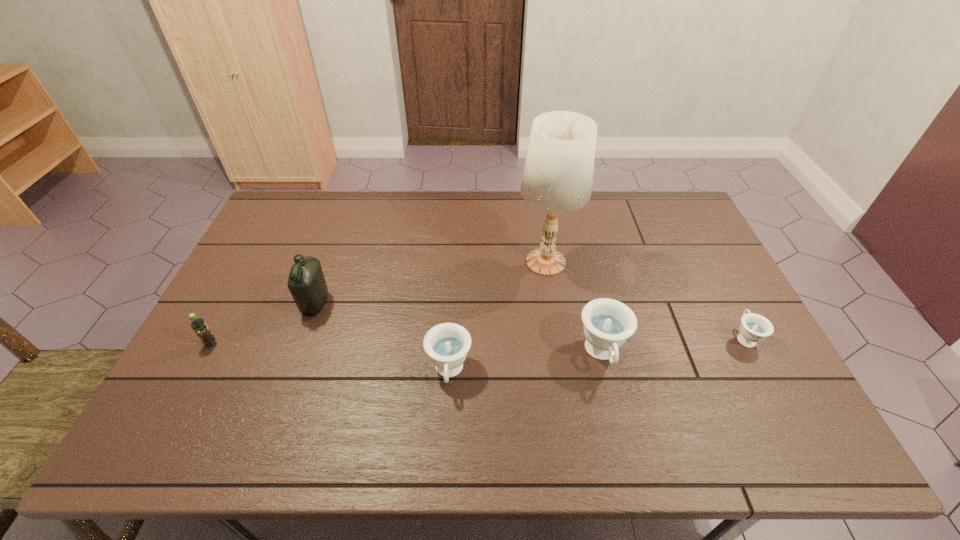
Find the location of a particular element. The width and height of the screenshot is (960, 540). free space for a new teacup on the left is located at coordinates (x=285, y=391).